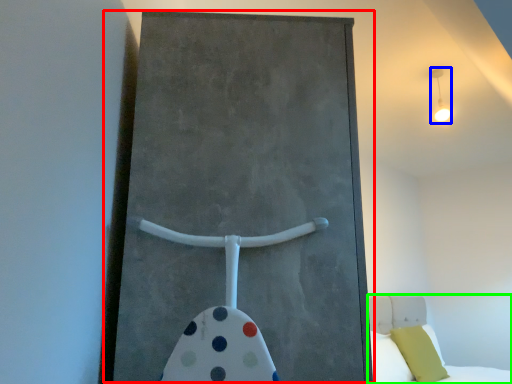
Question: Which object is positioned farthest from barn door (highlighted by a red box)? Select from light fixture (highlighted by a blue box) and bed (highlighted by a green box).

Choices:
 (A) light fixture
 (B) bed

Answer: (B)